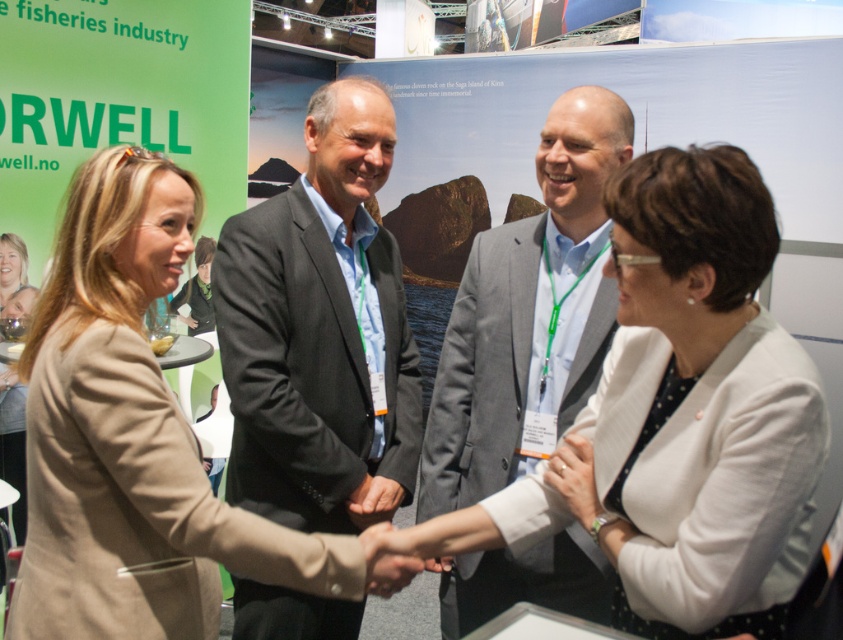
Between dark gray suit at center and white matte ring at center, which one has more height?

dark gray suit at center

Describe the element at coordinates (319, 326) in the screenshot. I see `dark gray suit at center` at that location.

Where is `dark gray suit at center`? The height and width of the screenshot is (640, 843). dark gray suit at center is located at coordinates (319, 326).

Does point (331, 241) come in front of point (390, 493)?

No.

Between dark gray suit at center and matte black hand at center, which one has less height?

matte black hand at center is shorter.

Which is behind, point (258, 490) or point (361, 500)?

The point (361, 500) is more distant.

The height and width of the screenshot is (640, 843). Identify the location of dark gray suit at center. (319, 326).

Which is more to the left, dark gray suit at center or matte beige blazer at center?

Positioned to the left is matte beige blazer at center.

Which of these two, dark gray suit at center or matte beige blazer at center, stands shorter?

matte beige blazer at center

Who is more distant from viewer, [330,208] or [201,280]?

Point [201,280]

Image resolution: width=843 pixels, height=640 pixels. Find the location of `dark gray suit at center`. dark gray suit at center is located at coordinates (319, 326).